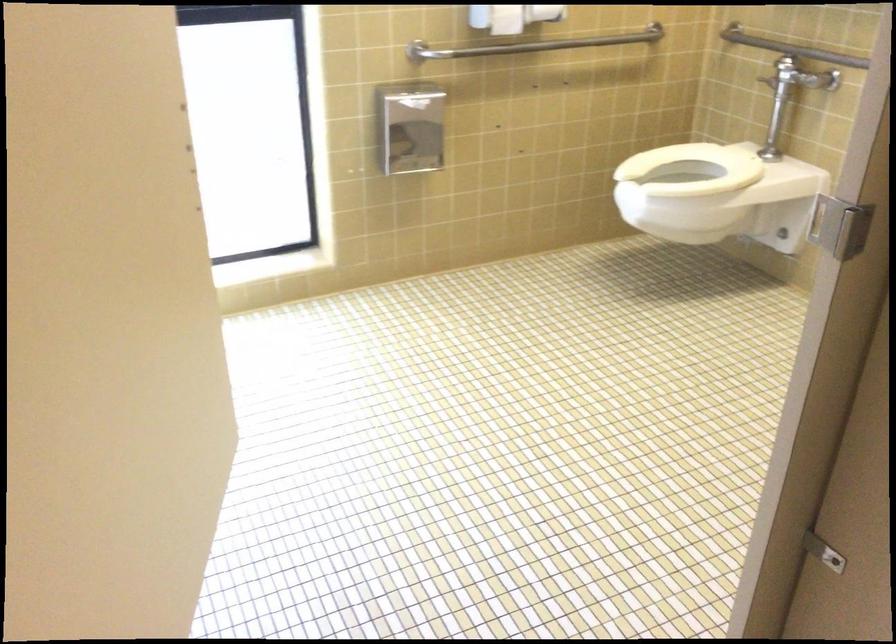
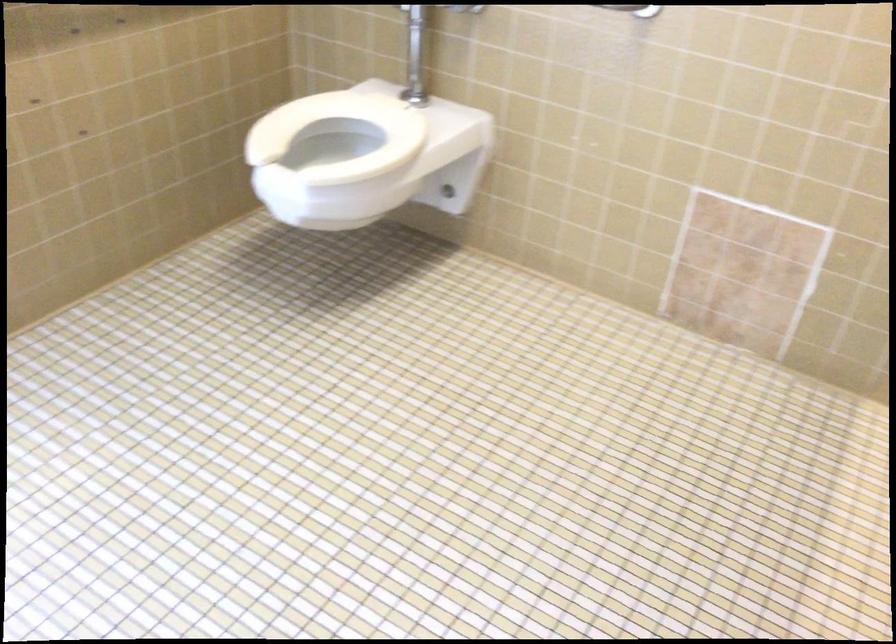
Find the pixel in the second image that matches (699,171) in the first image.

(339, 134)